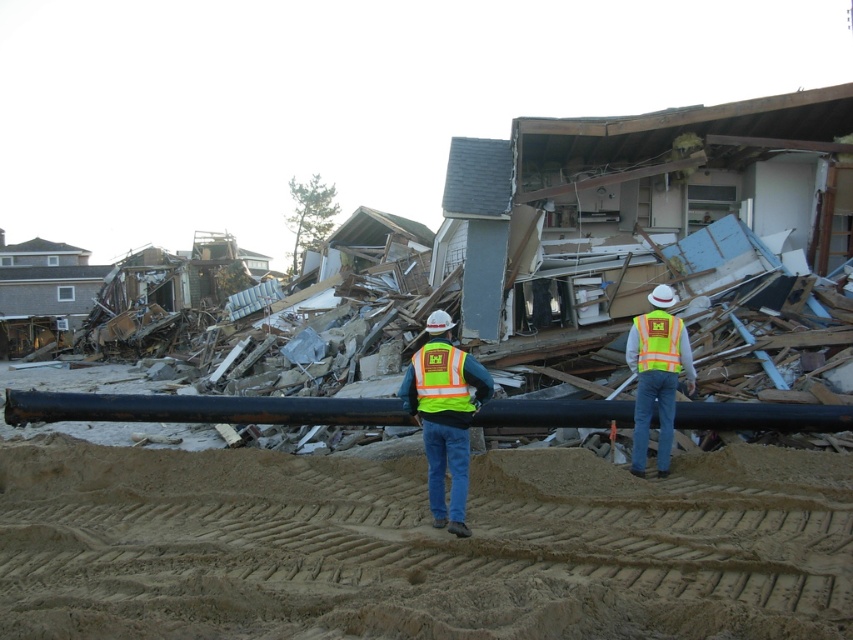
Question: Can you confirm if brown sandy dirt track at lower center is bigger than neon yellow reflective vest at center?

Choices:
 (A) no
 (B) yes

Answer: (A)

Question: Is black rubber water pipe at center bigger than neon yellow reflective vest at center?

Choices:
 (A) yes
 (B) no

Answer: (A)

Question: Which object appears farthest from the camera in this image?

Choices:
 (A) black rubber water pipe at center
 (B) brown sandy dirt track at lower center
 (C) hi-visibility reflective vest at center

Answer: (C)

Question: Based on their relative distances, which object is nearer to the brown sandy dirt track at lower center?

Choices:
 (A) neon yellow reflective vest at center
 (B) black rubber water pipe at center

Answer: (A)

Question: Which of these objects is positioned farthest from the hi-visibility reflective vest at center?

Choices:
 (A) black rubber water pipe at center
 (B) hi-visibility reflective safety vest at center
 (C) neon yellow reflective vest at center

Answer: (C)

Question: Where is black rubber water pipe at center located in relation to neon yellow reflective vest at center in the image?

Choices:
 (A) above
 (B) below

Answer: (B)